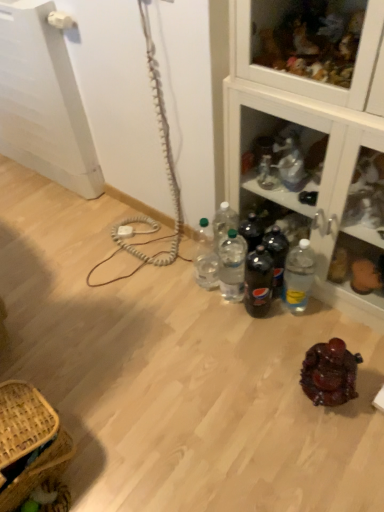
Locate an element on the screen. This screenshot has width=384, height=512. free space in front of clear plastic bottles at center, marked as the second bottle in a left-to-right arrangement is located at coordinates (239, 329).